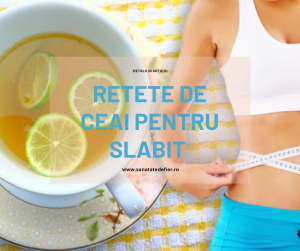
You are a GUI agent. You are given a task and a screenshot of the screen. Output one action in this format:
    pyautogui.click(x=<x>, y=<y>)
    Task: Click on the small teacup saucer
    The height and width of the screenshot is (251, 300).
    Given the screenshot: What is the action you would take?
    coord(52,225)